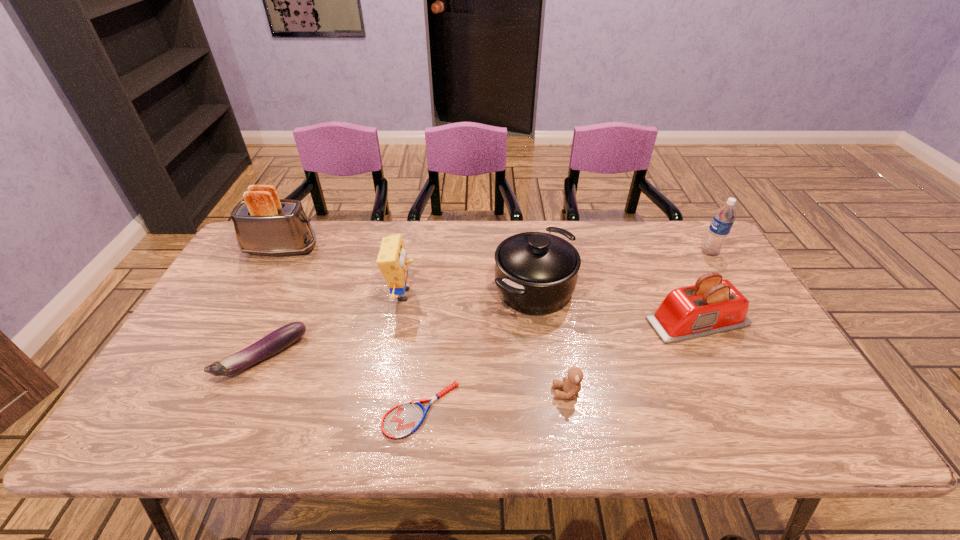
Image resolution: width=960 pixels, height=540 pixels. In order to click on empty space between the seventh tallest object and the shorter toaster in this screenshot , I will do `click(480, 339)`.

Select which object is the fourth closest to the sponge. Please provide its 2D coordinates. Your answer should be formatted as a tuple, i.e. [(x, y)], where the tuple contains the x and y coordinates of a point satisfying the conditions above.

[(264, 224)]

Where is `the fourth closest object to the taller toaster`? This screenshot has width=960, height=540. the fourth closest object to the taller toaster is located at coordinates (536, 273).

Find the location of a particular element. The height and width of the screenshot is (540, 960). vacant space that satisfies the following two spatial constraints: 1. on the side of the taller toaster with the control lever; 2. on the back side of the saucepan is located at coordinates (259, 289).

Identify the location of vacant area in the image that satisfies the following two spatial constraints: 1. on the face of the sponge; 2. on the back side of the shorter toaster. (397, 321).

At what (x,y) coordinates should I click in order to perform the action: click on blank space that satisfies the following two spatial constraints: 1. on the side of the farther toaster with the control lever; 2. on the left side of the water bottle. Please return your answer as a coordinate pair (x, y). This screenshot has height=540, width=960. Looking at the image, I should click on (279, 252).

Locate an element on the screen. Image resolution: width=960 pixels, height=540 pixels. vacant point that satisfies the following two spatial constraints: 1. on the side of the tennis racket with the control lever; 2. on the right side of the farther toaster is located at coordinates (195, 410).

The image size is (960, 540). Identify the location of vacant region that satisfies the following two spatial constraints: 1. on the side of the right toaster with the control lever; 2. on the right side of the left toaster. (242, 321).

Where is `blank space that satisfies the following two spatial constraints: 1. on the front side of the right toaster; 2. on the front-facing side of the teddy bear`? blank space that satisfies the following two spatial constraints: 1. on the front side of the right toaster; 2. on the front-facing side of the teddy bear is located at coordinates (732, 392).